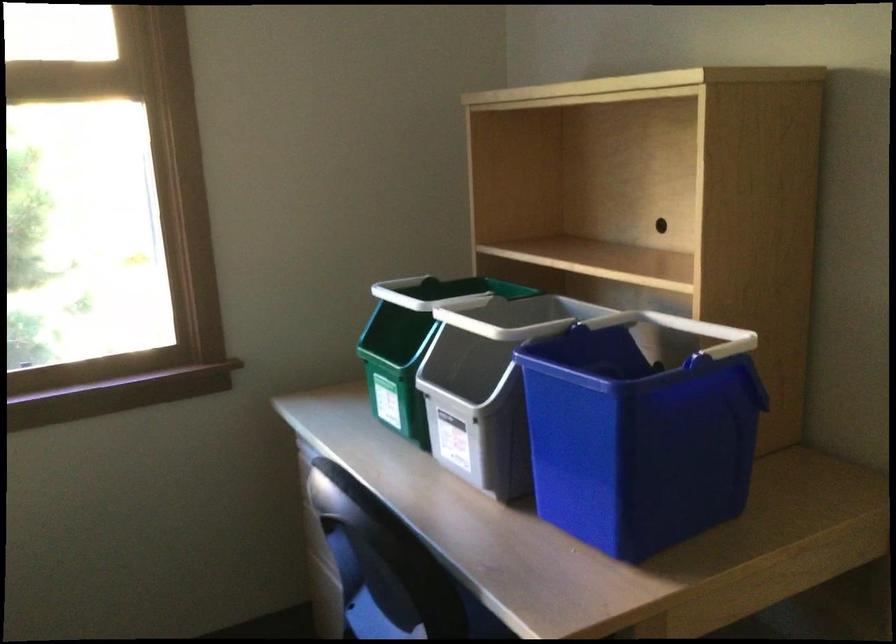
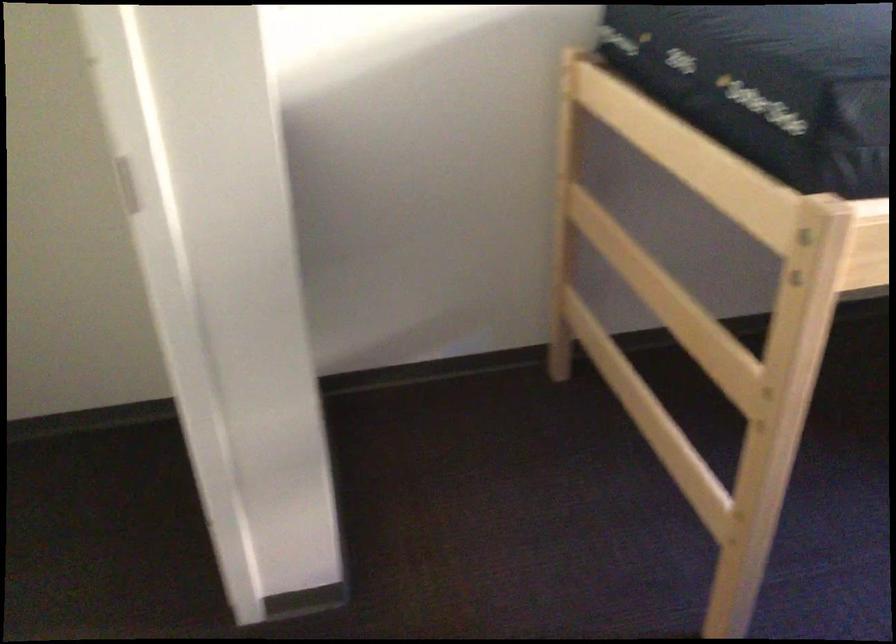
The first image is from the beginning of the video and the second image is from the end. How did the camera likely rotate when shooting the video?

The rotation direction of the camera is left-down.